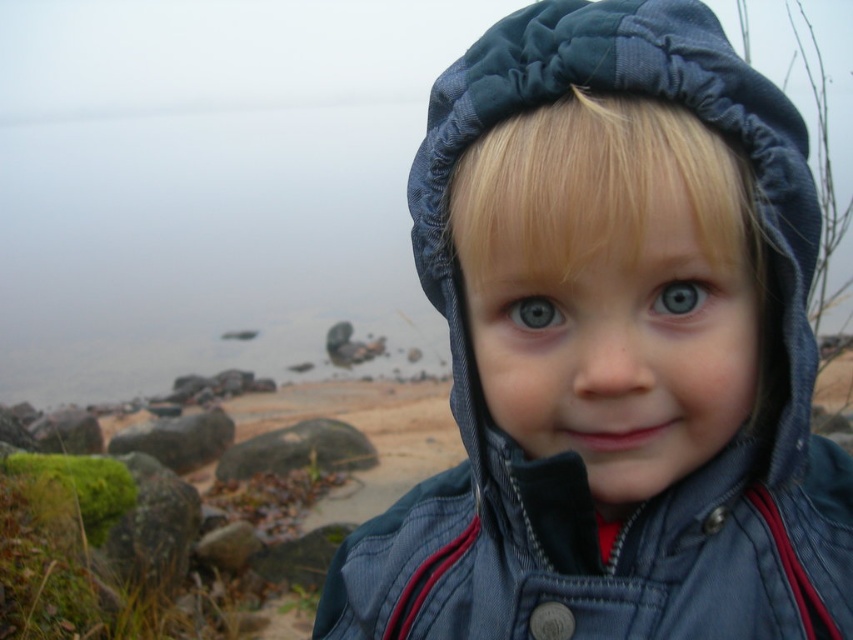
Can you confirm if green mossy rock at center is positioned below blue matte eye at center?

Yes, green mossy rock at center is below blue matte eye at center.

Is point (311, 436) closer to camera compared to point (685, 280)?

No.

Does point (299, 465) lie behind point (659, 316)?

Yes, it is.

Locate an element on the screen. This screenshot has height=640, width=853. green mossy rock at center is located at coordinates (299, 451).

Looking at this image, is denim jacket at center in front of green mossy rock at center?

Yes.

Is point (775, 570) closer to camera compared to point (248, 448)?

Yes.

Who is more distant from viewer, [753,136] or [291,458]?

Positioned behind is point [291,458].

The image size is (853, 640). In order to click on denim jacket at center in this screenshot , I will do `click(573, 454)`.

Does green mossy rock at center have a larger size compared to blue glossy eye at center?

Yes, green mossy rock at center is bigger than blue glossy eye at center.

Can you confirm if green mossy rock at center is smaller than blue glossy eye at center?

No, green mossy rock at center is not smaller than blue glossy eye at center.

At what (x,y) coordinates should I click in order to perform the action: click on green mossy rock at center. Please return your answer as a coordinate pair (x, y). This screenshot has width=853, height=640. Looking at the image, I should click on (299, 451).

Identify the location of green mossy rock at center. This screenshot has height=640, width=853. (299, 451).